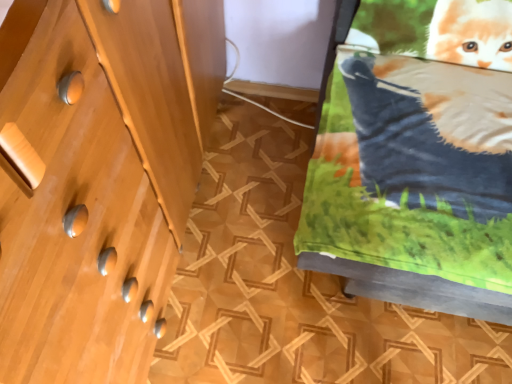
Locate an element on the screen. The height and width of the screenshot is (384, 512). free space to the left of printed cotton blanket at right is located at coordinates (249, 222).